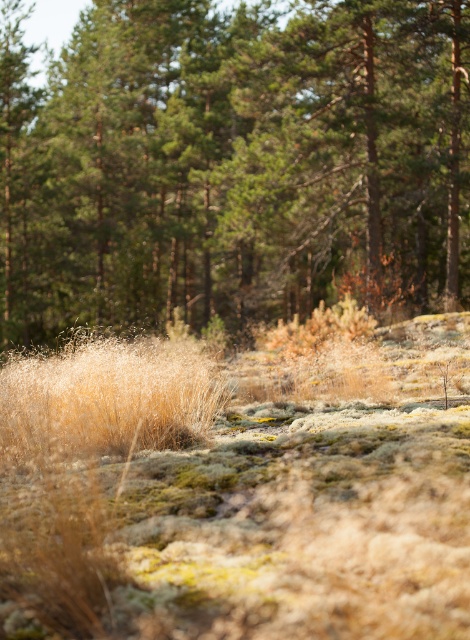
Does green textured pine forest at center have a greater height compared to dry grass at lower left?

Yes, green textured pine forest at center is taller than dry grass at lower left.

Who is higher up, green textured pine forest at center or dry grass at lower left?

Positioned higher is green textured pine forest at center.

The image size is (470, 640). Find the location of `green textured pine forest at center`. green textured pine forest at center is located at coordinates (235, 164).